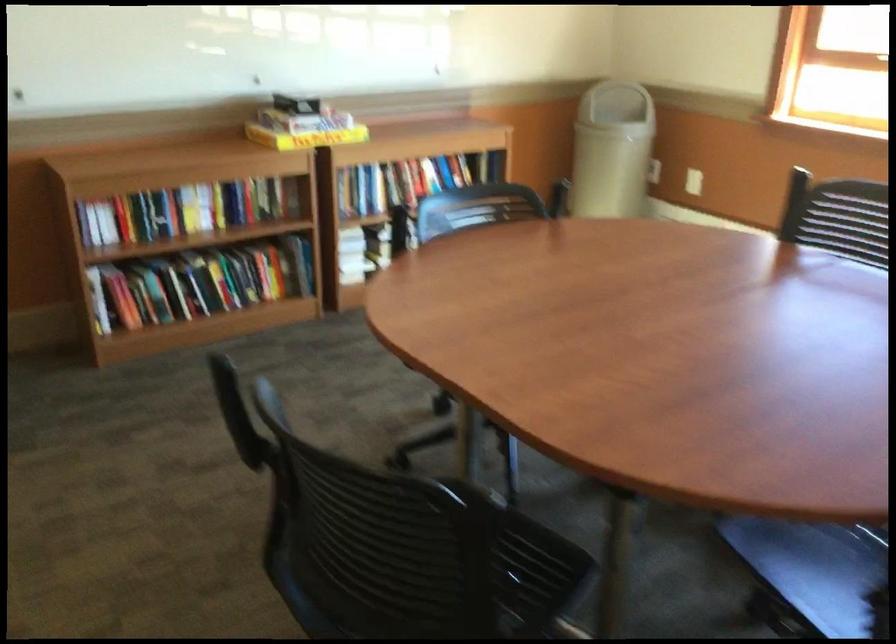
Locate an element on the screen. This screenshot has width=896, height=644. yellow board game box is located at coordinates (306, 138).